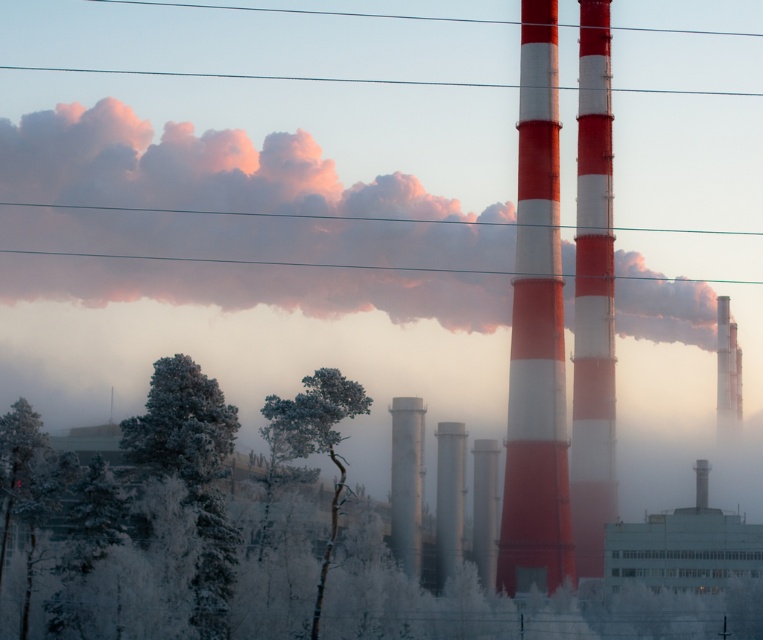
Question: Which object is positioned closest to the red and white striped chimney at right?

Choices:
 (A) smooth gray smokestack at right
 (B) transparent glass power line at upper center

Answer: (B)

Question: Which of the following is the farthest from the observer?

Choices:
 (A) red and white striped chimney at center
 (B) red and white striped chimney at right
 (C) satin silver cylinder at center
 (D) frosted pine tree at left

Answer: (A)

Question: Is the position of pink cotton cloud at upper center more distant than that of smooth metallic pipe at center?

Choices:
 (A) yes
 (B) no

Answer: (B)

Question: Which point is farther from the camera taking this photo?

Choices:
 (A) (462, 449)
 (B) (143, 278)
 (C) (98, 72)

Answer: (C)

Question: Can you confirm if satin silver cylinder at center is smaller than smooth metallic tower at center?

Choices:
 (A) yes
 (B) no

Answer: (B)

Question: Is the position of pink cotton cloud at upper center more distant than that of frosted white tree at lower left?

Choices:
 (A) yes
 (B) no

Answer: (A)